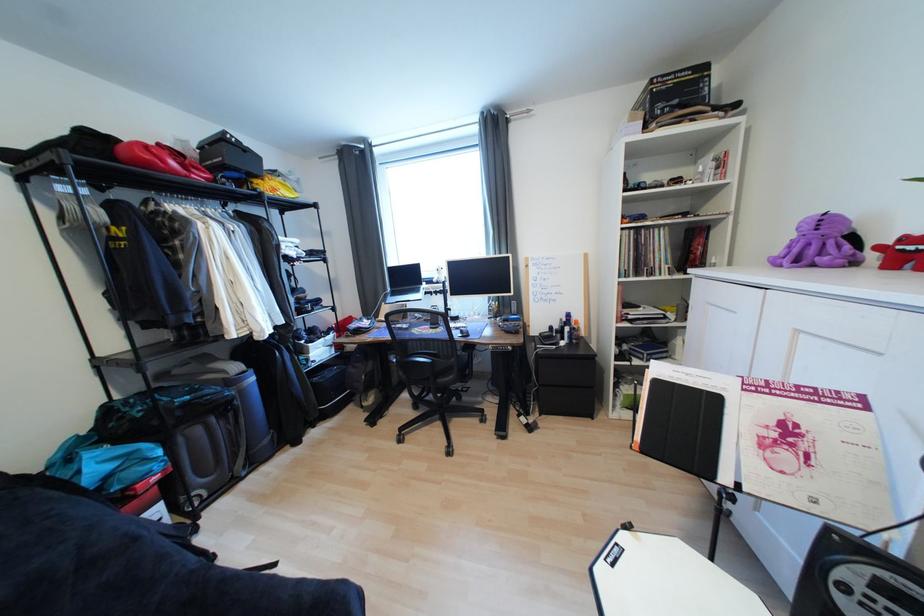
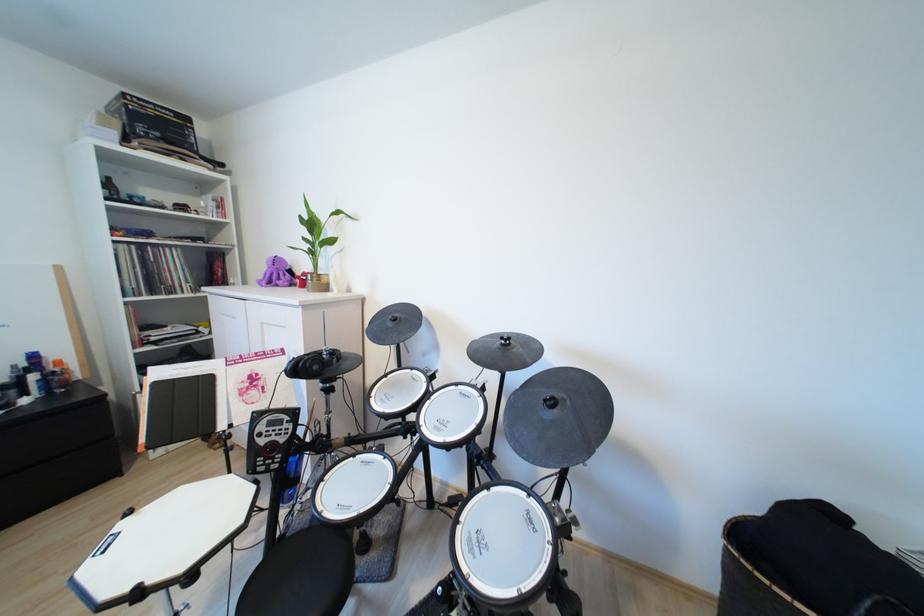
Locate, in the second image, the point that corresponds to point 584,323 in the first image.

(66, 363)